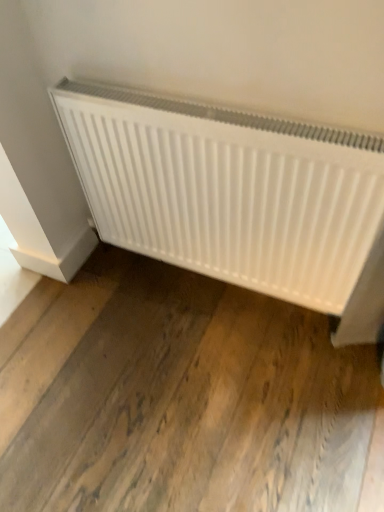
Where is `white matte radiator at lower left`? The height and width of the screenshot is (512, 384). white matte radiator at lower left is located at coordinates (227, 190).

The height and width of the screenshot is (512, 384). What do you see at coordinates (227, 190) in the screenshot?
I see `white matte radiator at lower left` at bounding box center [227, 190].

At what (x,y) coordinates should I click in order to perform the action: click on white matte radiator at lower left. Please return your answer as a coordinate pair (x, y). Looking at the image, I should click on (227, 190).